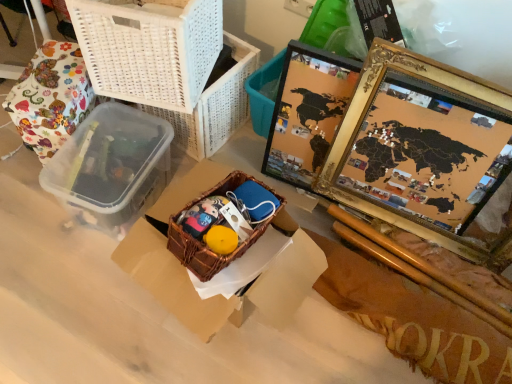
The height and width of the screenshot is (384, 512). I want to click on free spot to the left of brown woven basket at center, so (x=70, y=299).